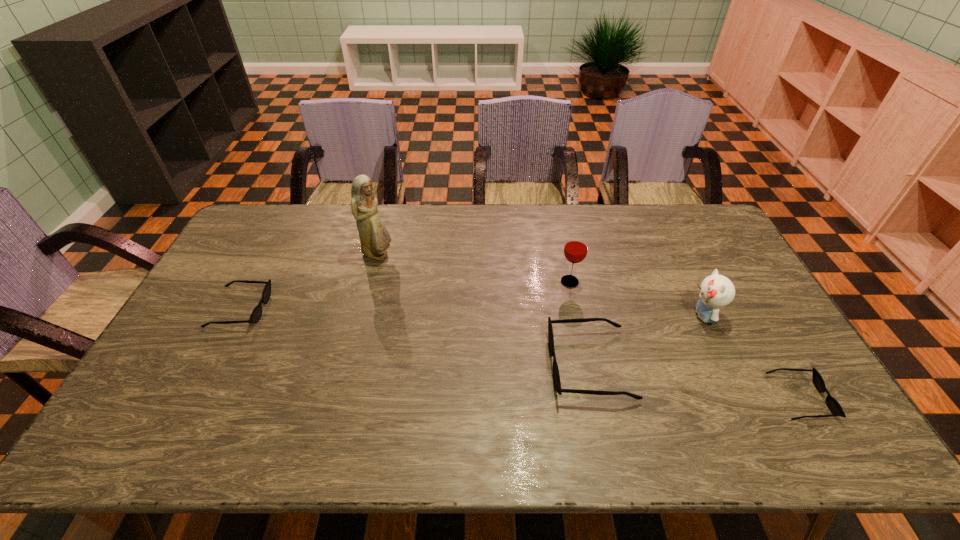
Identify the location of the fifth tallest object. This screenshot has height=540, width=960. (256, 314).

You are a GUI agent. You are given a task and a screenshot of the screen. Output one action in this format:
    pyautogui.click(x=<x>, y=<y>)
    Task: Click on the second tallest sunglasses
    The image size is (960, 540).
    Given the screenshot: What is the action you would take?
    pyautogui.click(x=256, y=314)

Where is `the tallest sunglasses`? The height and width of the screenshot is (540, 960). the tallest sunglasses is located at coordinates (556, 376).

This screenshot has height=540, width=960. Find the location of `the third shortest object`. the third shortest object is located at coordinates (556, 376).

Identify the location of the shortest object. Image resolution: width=960 pixels, height=540 pixels. coord(832,404).

The height and width of the screenshot is (540, 960). I want to click on the rightmost object, so click(x=832, y=404).

The height and width of the screenshot is (540, 960). Find the location of `kitten`. kitten is located at coordinates (716, 291).

Identify the location of the second object from right to left. (716, 291).

The width and height of the screenshot is (960, 540). Identify the location of glass. (576, 246).

You are a GUI agent. You are given a task and a screenshot of the screen. Output one action in this format:
    pyautogui.click(x=<x>, y=<y>)
    Task: Click on the tallest object
    
    Given the screenshot: What is the action you would take?
    pyautogui.click(x=374, y=237)